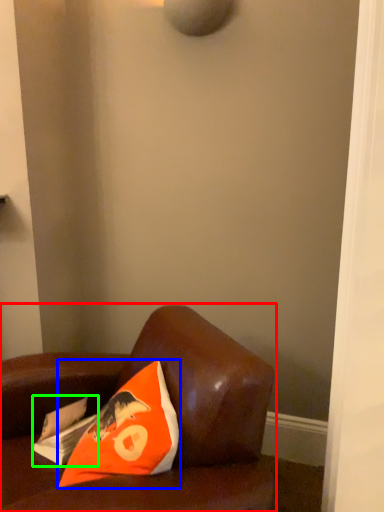
Question: Based on their relative distances, which object is farther from furniture (highlighted by a red box)? Choose from pillow (highlighted by a blue box) and magazine (highlighted by a green box).

Choices:
 (A) pillow
 (B) magazine

Answer: (B)